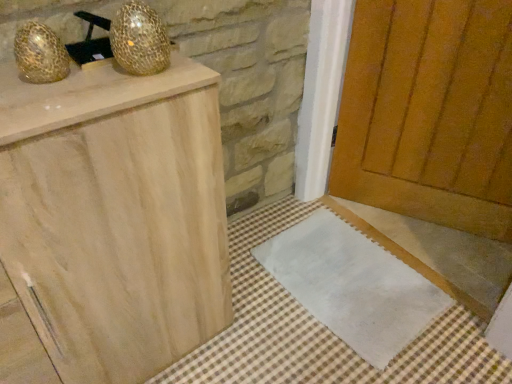
This screenshot has height=384, width=512. I want to click on free area below white fabric doormat at lower center (from a real-world perspective), so pyautogui.click(x=344, y=273).